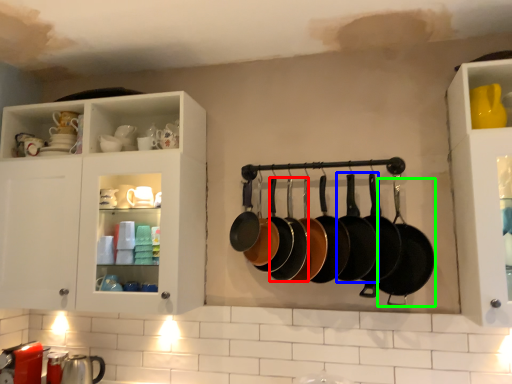
Question: Which object is positioned closest to frying pan (highlighted by a red box)? Select from frying pan (highlighted by a blue box) and frying pan (highlighted by a green box).

Choices:
 (A) frying pan
 (B) frying pan

Answer: (A)